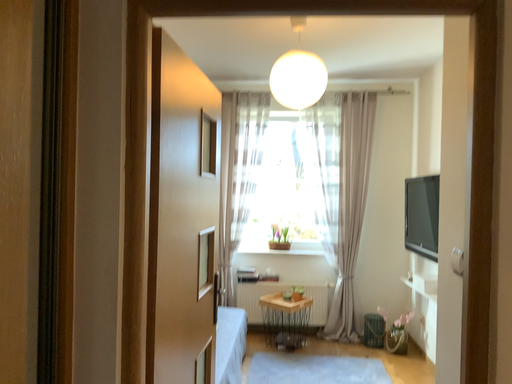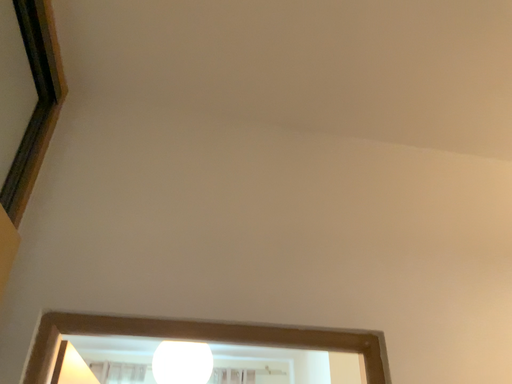
Question: How did the camera likely rotate when shooting the video?

Choices:
 (A) rotated left
 (B) rotated right

Answer: (B)